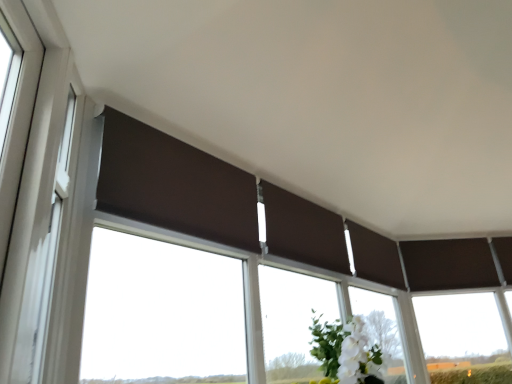
Question: Is white plastic window frame at left in front of or behind brown fabric window at center in the image?

Choices:
 (A) front
 (B) behind

Answer: (A)

Question: From a real-world perspective, is white plastic window frame at left positioned above or below brown fabric window at center?

Choices:
 (A) below
 (B) above

Answer: (B)

Question: Is white plastic window frame at left to the left or to the right of brown fabric window at center in the image?

Choices:
 (A) left
 (B) right

Answer: (A)

Question: From a real-world perspective, is brown fabric window at center physically located above or below white plastic window frame at left?

Choices:
 (A) above
 (B) below

Answer: (B)

Question: Is brown fabric window at center wider or thinner than white plastic window frame at left?

Choices:
 (A) wide
 (B) thin

Answer: (A)

Question: In the image, is brown fabric window at center on the left side or the right side of white plastic window frame at left?

Choices:
 (A) right
 (B) left

Answer: (A)

Question: Is brown fabric window at center bigger or smaller than white plastic window frame at left?

Choices:
 (A) big
 (B) small

Answer: (A)